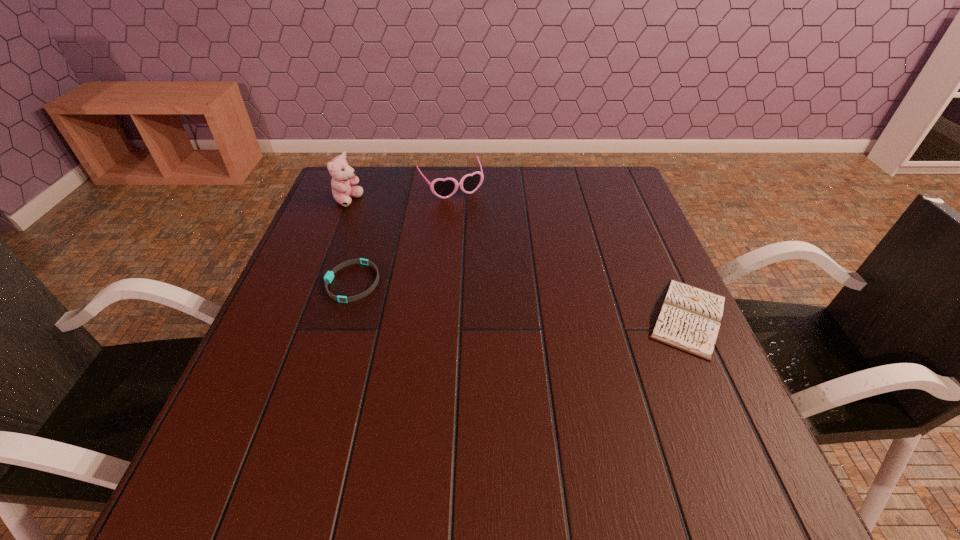
Locate an element on the screen. This screenshot has height=540, width=960. vacant region located on the front-facing side of the sunglasses is located at coordinates (484, 240).

The image size is (960, 540). In order to click on blank space located on the front-facing side of the sunglasses in this screenshot , I will do `click(507, 279)`.

The image size is (960, 540). I want to click on vacant position located on the front-facing side of the sunglasses, so click(509, 282).

Where is `teddy bear that is positioned at the far edge`? This screenshot has height=540, width=960. teddy bear that is positioned at the far edge is located at coordinates (343, 176).

This screenshot has height=540, width=960. What are the coordinates of `sunglasses present at the far edge` in the screenshot? It's located at (443, 188).

Where is `wristband positioned at the left edge`? wristband positioned at the left edge is located at coordinates (328, 277).

Identify the location of teddy bear that is at the left edge. This screenshot has width=960, height=540. (343, 176).

You are a GUI agent. You are given a task and a screenshot of the screen. Output one action in this format:
    pyautogui.click(x=<x>, y=<y>)
    Task: Click on the object at the right edge
    
    Given the screenshot: What is the action you would take?
    [x=689, y=319]

Where is `object located at the far left corner`? object located at the far left corner is located at coordinates (343, 176).

Identify the location of vacant space at the far edge. (567, 171).